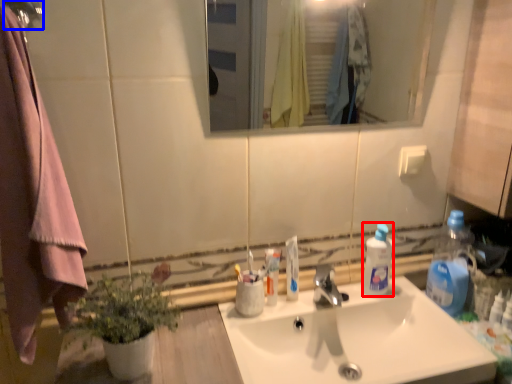
Question: Which object is further to the camera taking this photo, bottle (highlighted by a red box) or shower (highlighted by a blue box)?

Choices:
 (A) bottle
 (B) shower

Answer: (A)